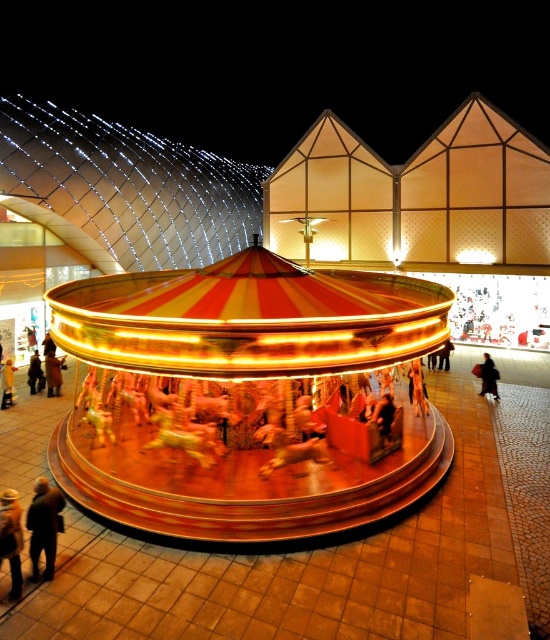
Question: Which of the following is the closest to the observer?

Choices:
 (A) (495, 374)
 (B) (15, 541)
 (C) (342, 384)
 (D) (35, 380)

Answer: (B)

Question: Considering the real-world distances, which object is farthest from the orange fabric jacket at lower left?

Choices:
 (A) brown leather jacket at center
 (B) dark brown leather jacket at lower left
 (C) black fabric at center

Answer: (C)

Question: Is orange fabric jacket at lower left positioned in front of brown leather jacket at center?

Choices:
 (A) no
 (B) yes

Answer: (B)

Question: Which object appears closest to the camera in this image?

Choices:
 (A) shiny gold carousel at center
 (B) silky yellow dress at center
 (C) black fabric at center
 (D) dark brown leather jacket at lower left

Answer: (D)

Question: Is the position of black fabric at center more distant than that of brown leather jacket at center?

Choices:
 (A) yes
 (B) no

Answer: (B)

Question: Is orange fabric jacket at lower left positioned before silky yellow dress at center?

Choices:
 (A) yes
 (B) no

Answer: (A)